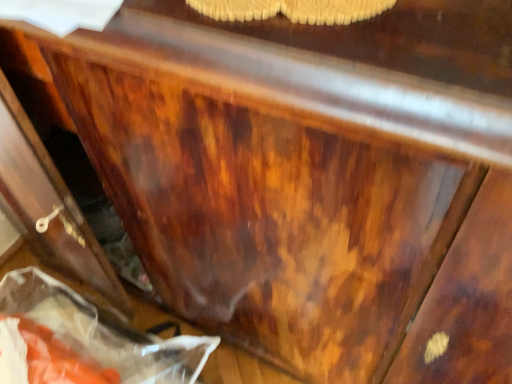
What is the approximate height of translucent plastic bag at lower left?

translucent plastic bag at lower left is 7.33 inches tall.

The width and height of the screenshot is (512, 384). What do you see at coordinates (103, 332) in the screenshot?
I see `translucent plastic bag at lower left` at bounding box center [103, 332].

Find the location of `translucent plastic bag at lower left`. translucent plastic bag at lower left is located at coordinates [103, 332].

Find the location of a particular element. The image size is (512, 384). translucent plastic bag at lower left is located at coordinates (103, 332).